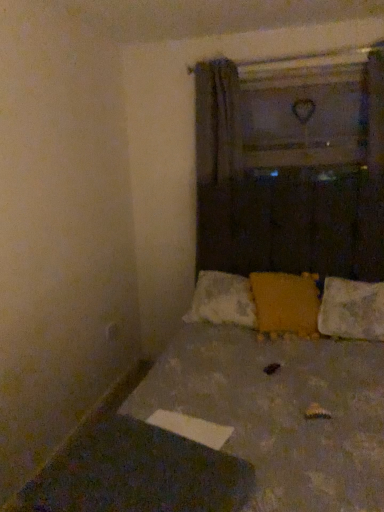
Locate an element on the screen. matte yellow pillow at center, which ranks as the first pillow in left-to-right order is located at coordinates (286, 303).

Image resolution: width=384 pixels, height=512 pixels. Describe the element at coordinates (352, 310) in the screenshot. I see `white textured pillow at lower right, positioned as the first pillow in right-to-left order` at that location.

Find the location of a particular element. The width and height of the screenshot is (384, 512). matte yellow pillow at center, which is the second pillow from right to left is located at coordinates (286, 303).

Is matte yellow pillow at center, which is the second pillow from right to left, shorter than white textured pillow at lower right, marked as the second pillow in a left-to-right arrangement?

In fact, matte yellow pillow at center, which is the second pillow from right to left, may be taller than white textured pillow at lower right, marked as the second pillow in a left-to-right arrangement.

Is matte yellow pillow at center, which ranks as the first pillow in left-to-right order, to the right of white textured pillow at lower right, marked as the second pillow in a left-to-right arrangement, from the viewer's perspective?

Incorrect, matte yellow pillow at center, which ranks as the first pillow in left-to-right order, is not on the right side of white textured pillow at lower right, marked as the second pillow in a left-to-right arrangement.

From the image's perspective, between matte yellow pillow at center, which ranks as the first pillow in left-to-right order, and white textured pillow at lower right, marked as the second pillow in a left-to-right arrangement, which one is located above?

matte yellow pillow at center, which ranks as the first pillow in left-to-right order, is shown above in the image.

Considering the positions of point (307, 277) and point (355, 297), is point (307, 277) closer or farther from the camera than point (355, 297)?

Point (307, 277) is positioned farther from the camera compared to point (355, 297).

This screenshot has width=384, height=512. In order to click on bed on the left of white textured pillow at lower right, positioned as the first pillow in right-to-left order in this screenshot , I will do `click(280, 395)`.

Which point is more forward, (233, 420) or (381, 324)?

The point (233, 420) is more forward.

Is textured fabric bed at center positioned with its back to white textured pillow at lower right, positioned as the first pillow in right-to-left order?

Yes.

How many degrees apart are the facing directions of textured fabric bed at center and white textured pillow at lower right, marked as the second pillow in a left-to-right arrangement?

The facing directions of textured fabric bed at center and white textured pillow at lower right, marked as the second pillow in a left-to-right arrangement, are 0.418 degrees apart.

Considering the sizes of objects white textured pillow at lower right, positioned as the first pillow in right-to-left order, and matte yellow pillow at center, which is the second pillow from right to left, in the image provided, who is bigger, white textured pillow at lower right, positioned as the first pillow in right-to-left order, or matte yellow pillow at center, which is the second pillow from right to left,?

matte yellow pillow at center, which is the second pillow from right to left, is bigger.

Is white textured pillow at lower right, positioned as the first pillow in right-to-left order, placed right next to matte yellow pillow at center, which is the second pillow from right to left?

No, white textured pillow at lower right, positioned as the first pillow in right-to-left order, is not making contact with matte yellow pillow at center, which is the second pillow from right to left.

Is white textured pillow at lower right, positioned as the first pillow in right-to-left order, taller or shorter than matte yellow pillow at center, which ranks as the first pillow in left-to-right order?

white textured pillow at lower right, positioned as the first pillow in right-to-left order, is shorter than matte yellow pillow at center, which ranks as the first pillow in left-to-right order.

Consider the image. From a real-world perspective, is white textured pillow at lower right, marked as the second pillow in a left-to-right arrangement, located beneath matte yellow pillow at center, which is the second pillow from right to left?

Correct, in the physical world, white textured pillow at lower right, marked as the second pillow in a left-to-right arrangement, is lower than matte yellow pillow at center, which is the second pillow from right to left.

Which of these two, white textured pillow at lower right, marked as the second pillow in a left-to-right arrangement, or textured fabric bed at center, is smaller?

With smaller size is white textured pillow at lower right, marked as the second pillow in a left-to-right arrangement.

From the image's perspective, does white textured pillow at lower right, marked as the second pillow in a left-to-right arrangement, appear higher than textured fabric bed at center?

Yes.

In the scene shown: Based on their positions, is white textured pillow at lower right, marked as the second pillow in a left-to-right arrangement, located to the left or right of textured fabric bed at center?

Clearly, white textured pillow at lower right, marked as the second pillow in a left-to-right arrangement, is on the right of textured fabric bed at center in the image.

How much distance is there between white textured pillow at lower right, marked as the second pillow in a left-to-right arrangement, and textured fabric bed at center?

white textured pillow at lower right, marked as the second pillow in a left-to-right arrangement, and textured fabric bed at center are 13.24 inches apart.

Between point (286, 331) and point (189, 365), which one is positioned behind?

Point (286, 331)

Between matte yellow pillow at center, which ranks as the first pillow in left-to-right order, and textured fabric bed at center, which one has more height?

Standing taller between the two is textured fabric bed at center.

Can you tell me how much matte yellow pillow at center, which is the second pillow from right to left, and textured fabric bed at center differ in facing direction?

The angle between the facing direction of matte yellow pillow at center, which is the second pillow from right to left, and the facing direction of textured fabric bed at center is 17.7 degrees.

Which of these two, matte yellow pillow at center, which ranks as the first pillow in left-to-right order, or textured fabric bed at center, is bigger?

Bigger between the two is textured fabric bed at center.

Considering the positions of objects textured fabric bed at center and matte yellow pillow at center, which is the second pillow from right to left, in the image provided, who is behind, textured fabric bed at center or matte yellow pillow at center, which is the second pillow from right to left,?

Positioned behind is matte yellow pillow at center, which is the second pillow from right to left.

From the picture: Is textured fabric bed at center directly adjacent to matte yellow pillow at center, which ranks as the first pillow in left-to-right order?

There is a gap between textured fabric bed at center and matte yellow pillow at center, which ranks as the first pillow in left-to-right order.

Based on the photo, from a real-world perspective, who is located lower, textured fabric bed at center or matte yellow pillow at center, which ranks as the first pillow in left-to-right order?

textured fabric bed at center, from a real-world perspective.

Which is in front, point (224, 334) or point (314, 287)?

The point (224, 334) is closer to the camera.

Image resolution: width=384 pixels, height=512 pixels. Find the location of `pillow in front of the matte yellow pillow at center, which ranks as the first pillow in left-to-right order`. pillow in front of the matte yellow pillow at center, which ranks as the first pillow in left-to-right order is located at coordinates (352, 310).

The image size is (384, 512). I want to click on the 2nd pillow to the right of the textured fabric bed at center, counting from the anchor's position, so click(x=352, y=310).

Which object lies nearer to the anchor point white textured pillow at lower right, marked as the second pillow in a left-to-right arrangement, matte yellow pillow at center, which is the second pillow from right to left, or textured fabric bed at center?

matte yellow pillow at center, which is the second pillow from right to left, is positioned closer to the anchor white textured pillow at lower right, marked as the second pillow in a left-to-right arrangement.

Estimate the real-world distances between objects in this image. Which object is closer to matte yellow pillow at center, which ranks as the first pillow in left-to-right order, white textured pillow at lower right, positioned as the first pillow in right-to-left order, or textured fabric bed at center?

white textured pillow at lower right, positioned as the first pillow in right-to-left order, is closer to matte yellow pillow at center, which ranks as the first pillow in left-to-right order.

Considering their positions, is textured fabric bed at center positioned closer to matte yellow pillow at center, which ranks as the first pillow in left-to-right order, than white textured pillow at lower right, marked as the second pillow in a left-to-right arrangement?

white textured pillow at lower right, marked as the second pillow in a left-to-right arrangement, is closer to matte yellow pillow at center, which ranks as the first pillow in left-to-right order.

Which object lies further to the anchor point white textured pillow at lower right, positioned as the first pillow in right-to-left order, textured fabric bed at center or matte yellow pillow at center, which is the second pillow from right to left?

Based on the image, textured fabric bed at center appears to be further to white textured pillow at lower right, positioned as the first pillow in right-to-left order.

From the image, which object appears to be nearer to textured fabric bed at center, white textured pillow at lower right, marked as the second pillow in a left-to-right arrangement, or matte yellow pillow at center, which is the second pillow from right to left?

matte yellow pillow at center, which is the second pillow from right to left, is positioned closer to the anchor textured fabric bed at center.

Considering their positions, is matte yellow pillow at center, which ranks as the first pillow in left-to-right order, positioned closer to textured fabric bed at center than white textured pillow at lower right, positioned as the first pillow in right-to-left order?

The object closer to textured fabric bed at center is matte yellow pillow at center, which ranks as the first pillow in left-to-right order.

The height and width of the screenshot is (512, 384). Find the location of `pillow between textured fabric bed at center and matte yellow pillow at center, which is the second pillow from right to left, in the front-back direction`. pillow between textured fabric bed at center and matte yellow pillow at center, which is the second pillow from right to left, in the front-back direction is located at coordinates (352, 310).